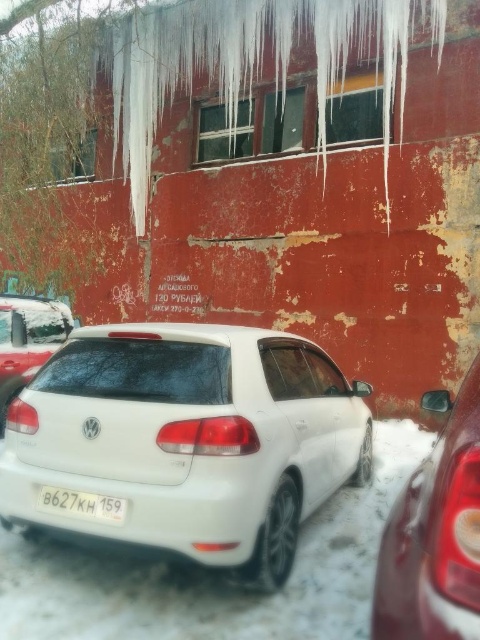
Is white glossy hatchback at center thinner than shiny red tail light at right?

Incorrect, white glossy hatchback at center's width is not less than shiny red tail light at right's.

Is the position of white glossy hatchback at center less distant than that of shiny red tail light at right?

No, it is not.

This screenshot has height=640, width=480. I want to click on white glossy hatchback at center, so click(189, 440).

Identify the location of white glossy hatchback at center. (189, 440).

Does white glossy hatchback at center have a greater height compared to white matte car at upper left?

In fact, white glossy hatchback at center may be shorter than white matte car at upper left.

Identify the location of white glossy hatchback at center. The width and height of the screenshot is (480, 640). (189, 440).

Is point (154, 374) positioned behind point (6, 376)?

No, it is in front of (6, 376).

Locate an element on the screen. white glossy hatchback at center is located at coordinates (189, 440).

Between white matte car at upper left and white plastic license plate at center, which one has less height?

white plastic license plate at center is shorter.

Does point (40, 332) come behind point (96, 497)?

Yes, point (40, 332) is farther from viewer.

Image resolution: width=480 pixels, height=640 pixels. I want to click on white matte car at upper left, so click(26, 340).